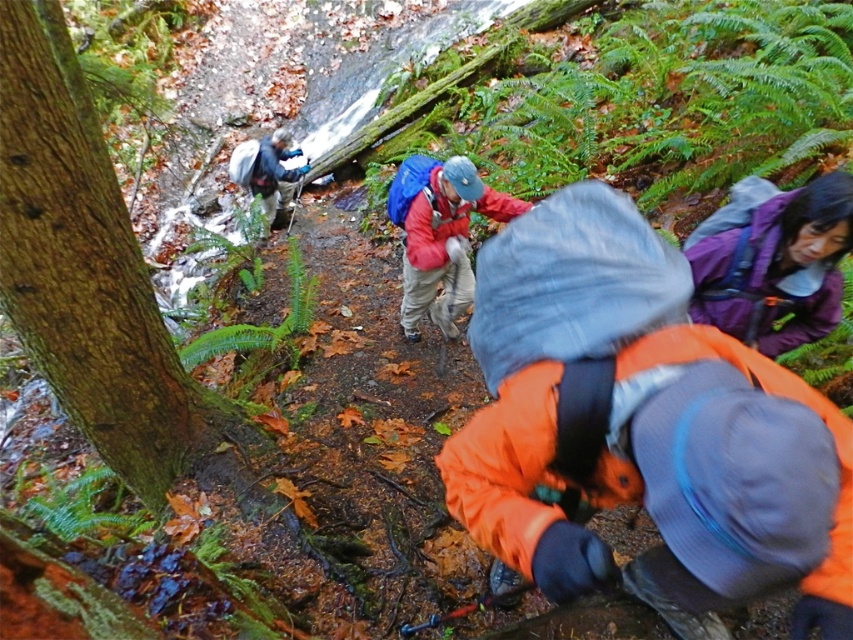
You are a hiker planning to take a photo of both the orange fleece jacket at lower right and the purple fleece jacket at upper right. Which jacket should you focus on first to ensure both are in the frame?

You should focus on the orange fleece jacket at lower right first because it is taller than the purple fleece jacket at upper right, ensuring it fits within the frame when adjusting the camera angle.

Consider the image. You are a hiker planning to move from the orange fleece jacket at lower right to the purple fleece jacket at upper right. Given that your backpack measures 2.5 feet in length, will you have enough space to walk directly between them without needing to adjust your path?

The orange fleece jacket at lower right and purple fleece jacket at upper right are 3.72 feet apart from each other. Since your backpack is 2.5 feet long, there is sufficient space between them for you to walk directly without needing to adjust your path.